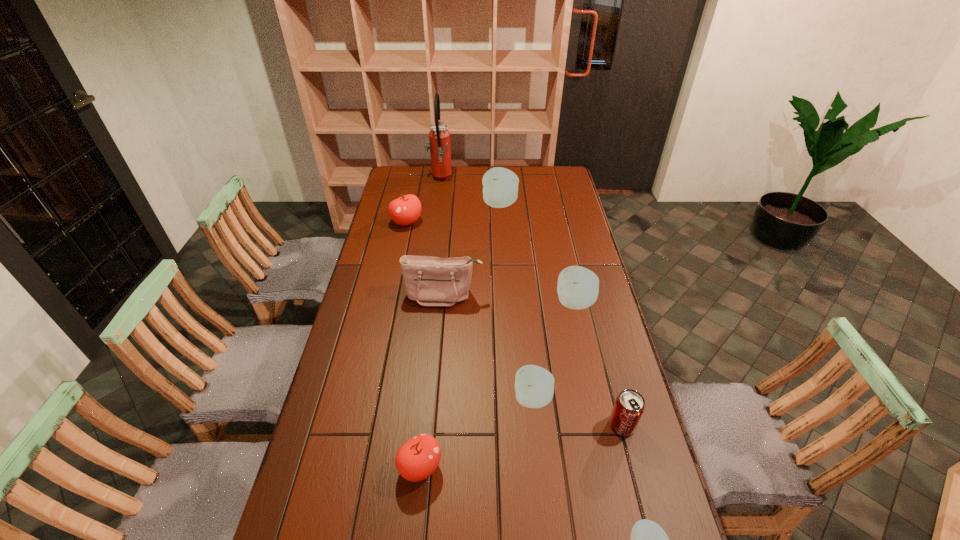
Locate an element on the screen. Image resolution: width=960 pixels, height=540 pixels. the fourth farthest apple is located at coordinates (534, 385).

Locate an element on the screen. the second smallest white apple is located at coordinates (534, 385).

This screenshot has height=540, width=960. I want to click on the right red apple, so click(x=418, y=458).

Where is `the nearer red apple`? This screenshot has height=540, width=960. the nearer red apple is located at coordinates (418, 458).

Identify the location of vacant point located at the nozzle of the tallest object. This screenshot has width=960, height=540. (473, 179).

At what (x,y) coordinates should I click in order to perform the action: click on free space located 0.310m on the front of the farthest white apple. Please return your answer as a coordinate pair (x, y). Looking at the image, I should click on (503, 258).

Find the location of `vacant area situated on the front pocket of the shoulder bag`. vacant area situated on the front pocket of the shoulder bag is located at coordinates tap(437, 372).

Identify the location of vacant space situated 0.360m on the left of the second farthest white apple. Image resolution: width=960 pixels, height=540 pixels. (457, 303).

You are a GUI agent. You are given a task and a screenshot of the screen. Output one action in this format:
    pyautogui.click(x=<x>, y=<y>)
    Task: Click on the free region located on the front of the bigger red apple
    
    Given the screenshot: What is the action you would take?
    pyautogui.click(x=400, y=252)

Identify the location of vacant space situated on the front of the pop soda. This screenshot has width=960, height=540. (631, 458).